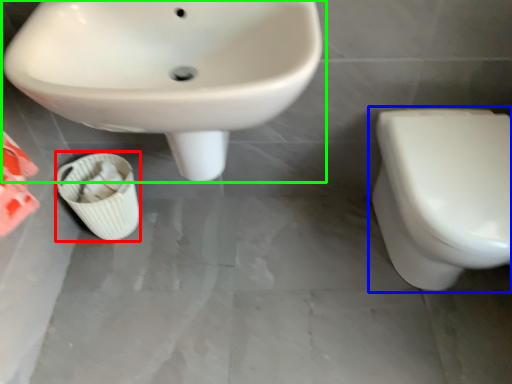
Question: Which object is positioned closest to potty (highlighted by a red box)? Select from toilet (highlighted by a blue box) and sink (highlighted by a green box).

Choices:
 (A) toilet
 (B) sink

Answer: (B)